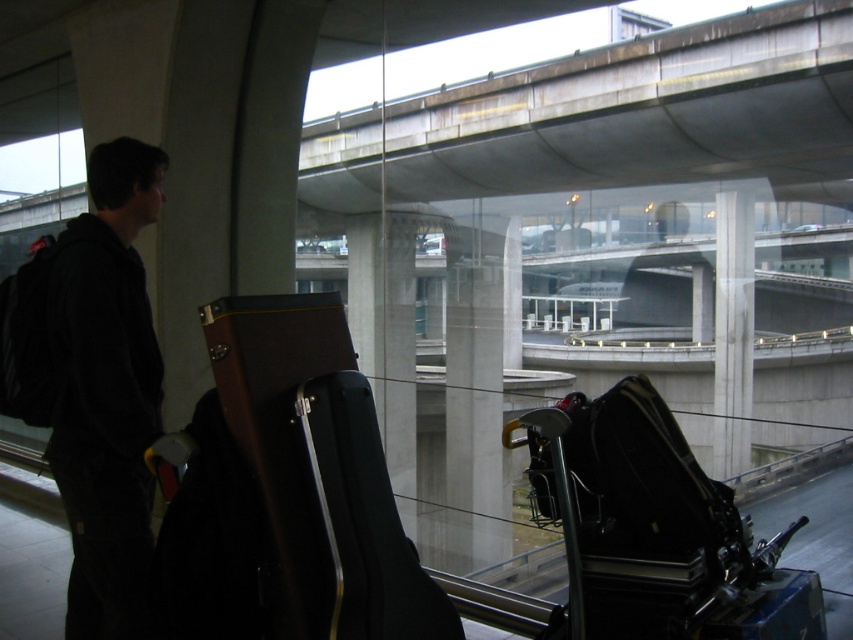
Measure the distance between brown leather guitar case at center and camera.

brown leather guitar case at center is 6.25 feet from camera.

Between brown leather guitar case at center and dark gray hoodie at left, which one appears on the right side from the viewer's perspective?

brown leather guitar case at center is more to the right.

In order to click on brown leather guitar case at center in this screenshot , I will do `click(318, 472)`.

Who is taller, concrete overpass at upper center or dark gray hoodie at left?

With more height is concrete overpass at upper center.

Does concrete overpass at upper center have a greater height compared to dark gray hoodie at left?

Yes, concrete overpass at upper center is taller than dark gray hoodie at left.

Does point (848, 8) come in front of point (158, 435)?

No, (848, 8) is behind (158, 435).

You are a GUI agent. You are given a task and a screenshot of the screen. Output one action in this format:
    pyautogui.click(x=<x>, y=<y>)
    Task: Click on the concrete overpass at upper center
    
    Given the screenshot: What is the action you would take?
    pyautogui.click(x=643, y=113)

Is concrete overpass at upper center smaller than black hardshell suitcase at lower right?

Indeed, concrete overpass at upper center has a smaller size compared to black hardshell suitcase at lower right.

Which is below, concrete overpass at upper center or black hardshell suitcase at lower right?

Positioned lower is black hardshell suitcase at lower right.

Where is `concrete overpass at upper center`? This screenshot has height=640, width=853. concrete overpass at upper center is located at coordinates (643, 113).